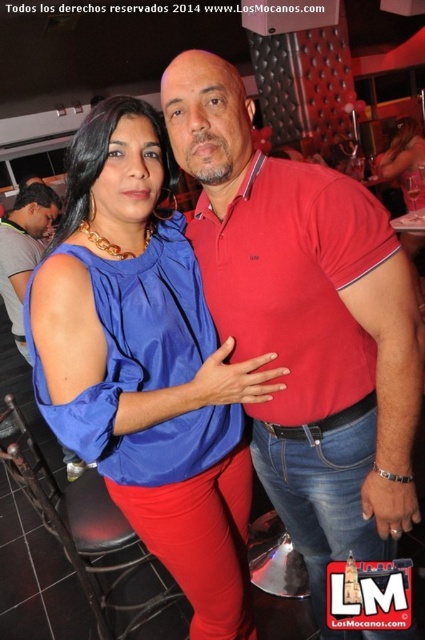
Between blue satin blouse at center and gray fabric shirt at left, which one has less height?

gray fabric shirt at left is shorter.

Is blue satin blouse at center to the right of gray fabric shirt at left from the viewer's perspective?

Indeed, blue satin blouse at center is positioned on the right side of gray fabric shirt at left.

Where is `blue satin blouse at center`? This screenshot has height=640, width=425. blue satin blouse at center is located at coordinates (147, 364).

Locate an element on the screen. blue satin blouse at center is located at coordinates (147, 364).

Does red cotton polo shirt at center appear under matte blue shirt at center?

Correct, red cotton polo shirt at center is located below matte blue shirt at center.

At what (x,y) coordinates should I click in order to perform the action: click on red cotton polo shirt at center. Please return your answer as a coordinate pair (x, y). This screenshot has height=640, width=425. Looking at the image, I should click on (306, 323).

Can you confirm if red cotton polo shirt at center is positioned to the left of blue satin blouse at center?

Incorrect, red cotton polo shirt at center is not on the left side of blue satin blouse at center.

Identify the location of red cotton polo shirt at center. (306, 323).

Find the location of a particular element. This screenshot has height=640, width=425. red cotton polo shirt at center is located at coordinates (306, 323).